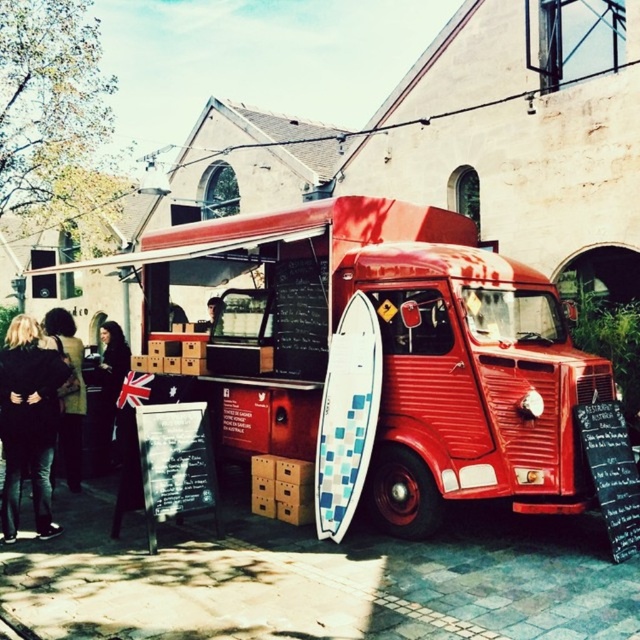
Question: Among these objects, which one is nearest to the camera?

Choices:
 (A) smooth skin face at center
 (B) dark brown hair at left
 (C) black leather jacket at lower left

Answer: (C)

Question: Which point appears closest to the camera in this image?

Choices:
 (A) (321, 422)
 (B) (396, 268)
 (C) (42, 387)
 (D) (84, 392)

Answer: (C)

Question: From the image, what is the correct spatial relationship of shiny red van at center in relation to dark brown hair at left?

Choices:
 (A) right
 (B) left

Answer: (A)

Question: Does shiny red van at center have a larger size compared to black leather jacket at lower left?

Choices:
 (A) yes
 (B) no

Answer: (A)

Question: Considering the real-world distances, which object is farthest from the smooth skin face at center?

Choices:
 (A) dark brown leather jacket at lower left
 (B) white checkered surfboard at center

Answer: (B)

Question: Is white checkered surfboard at center bigger than dark brown hair at left?

Choices:
 (A) yes
 (B) no

Answer: (A)